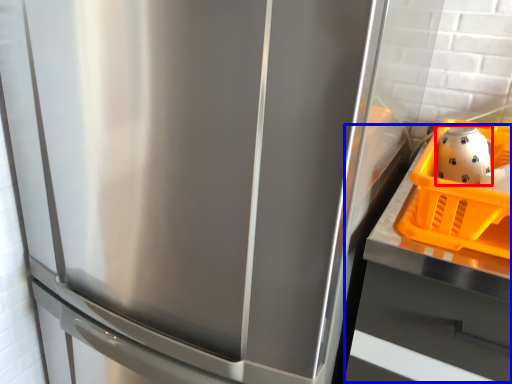
Question: Which point is further to the camera, tea pot (highlighted by a red box) or counter top (highlighted by a blue box)?

Choices:
 (A) tea pot
 (B) counter top

Answer: (A)